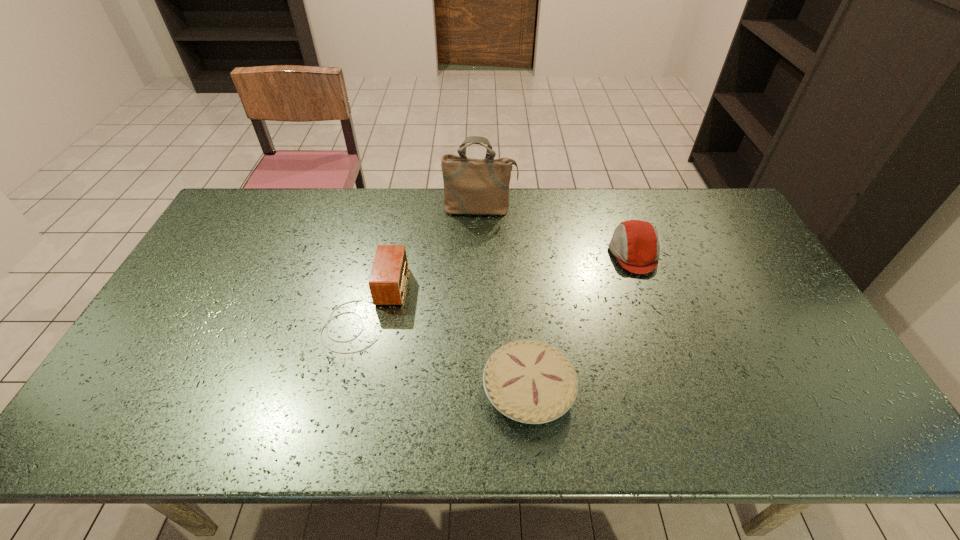
The height and width of the screenshot is (540, 960). I want to click on the farthest object, so click(471, 186).

This screenshot has height=540, width=960. I want to click on the tallest object, so click(x=471, y=186).

The height and width of the screenshot is (540, 960). In order to click on the leftmost object in this screenshot , I will do `click(387, 282)`.

At what (x,y) coordinates should I click in order to perform the action: click on the rightmost object. Please return your answer as a coordinate pair (x, y). This screenshot has height=540, width=960. Looking at the image, I should click on (635, 244).

The image size is (960, 540). I want to click on the shortest object, so click(529, 381).

Where is `free location located on the front-facing side of the farthest object`? The image size is (960, 540). free location located on the front-facing side of the farthest object is located at coordinates (480, 302).

This screenshot has width=960, height=540. Identify the location of vacant area situated on the front-facing side of the radio receiver. (420, 307).

The width and height of the screenshot is (960, 540). I want to click on free space located on the front-facing side of the cap, so click(490, 254).

Locate an element on the screen. vacant space located on the front-facing side of the cap is located at coordinates (x=568, y=254).

Image resolution: width=960 pixels, height=540 pixels. Find the location of `free space located on the front-facing side of the cap`. free space located on the front-facing side of the cap is located at coordinates (584, 254).